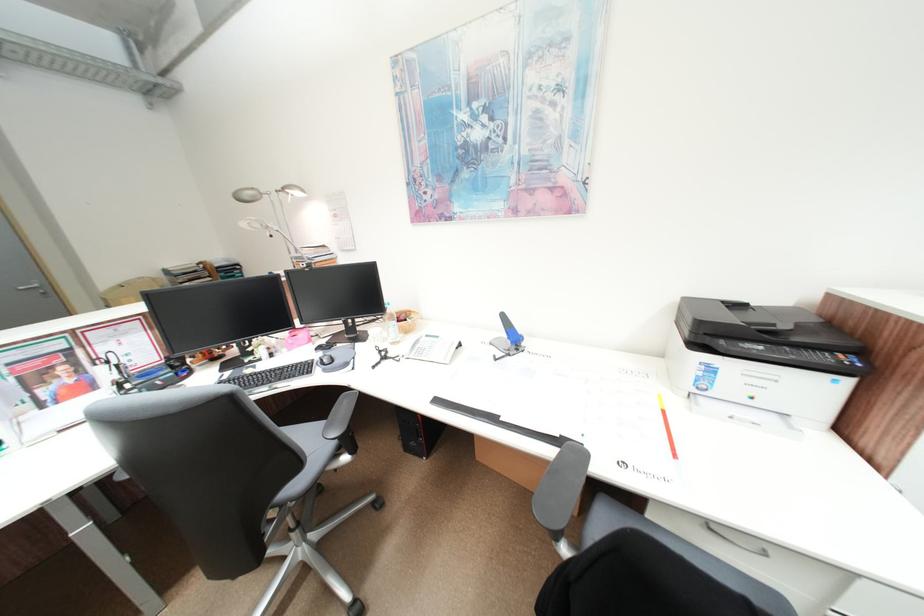
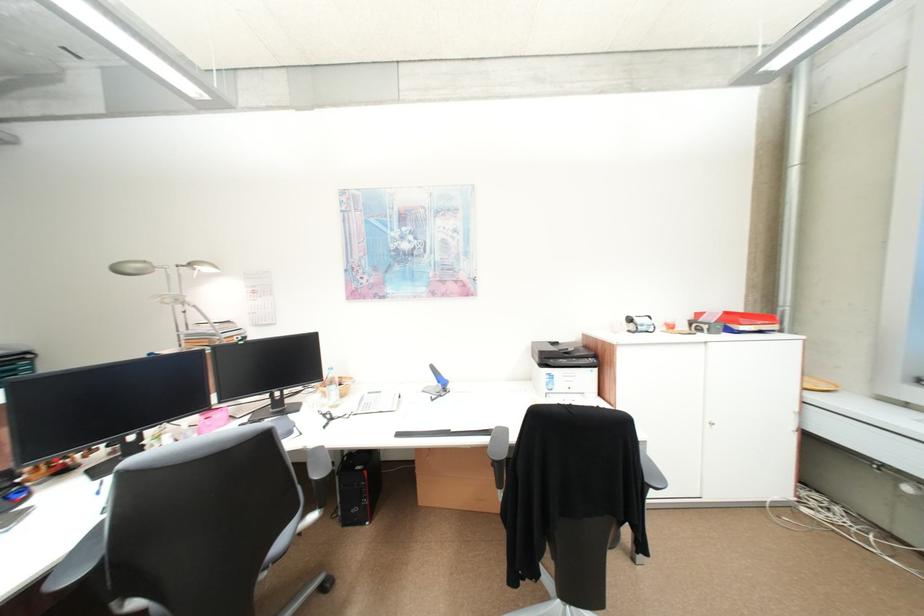
In the second image, find the point that corresponds to pixel 710 323 in the first image.

(551, 353)